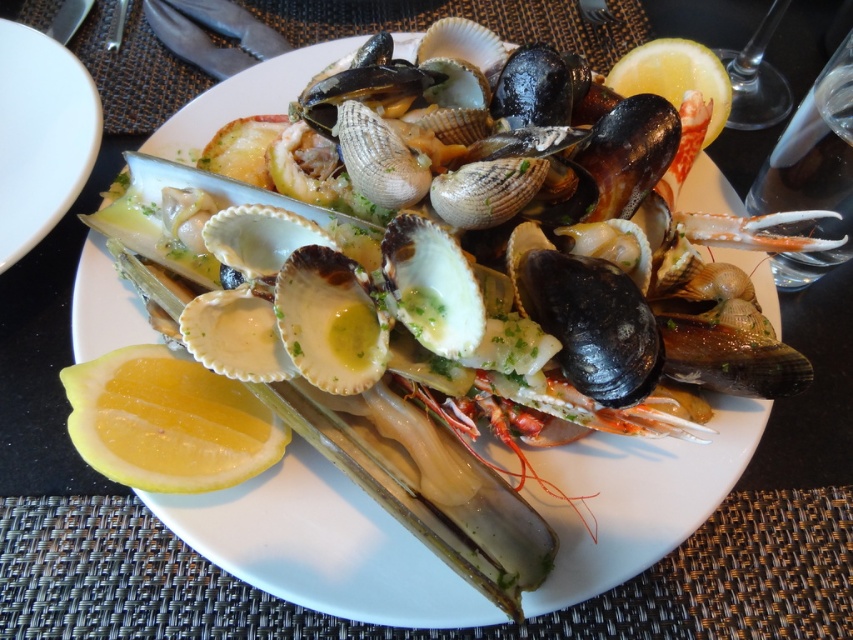
Which of these two, white glossy plate at upper left or yellow matte lemon at upper right, stands taller?

Standing taller between the two is white glossy plate at upper left.

Consider the image. Does white glossy plate at upper left appear over yellow matte lemon at upper right?

No.

This screenshot has width=853, height=640. Describe the element at coordinates (39, 134) in the screenshot. I see `white glossy plate at upper left` at that location.

The image size is (853, 640). In order to click on white glossy plate at upper left in this screenshot , I will do `click(39, 134)`.

Can you confirm if yellow juicy lemon at lower left is positioned to the left of yellow matte lemon at upper right?

Indeed, yellow juicy lemon at lower left is positioned on the left side of yellow matte lemon at upper right.

Is yellow juicy lemon at lower left above yellow matte lemon at upper right?

No, yellow juicy lemon at lower left is not above yellow matte lemon at upper right.

Describe the element at coordinates (167, 422) in the screenshot. I see `yellow juicy lemon at lower left` at that location.

Locate an element on the screen. yellow juicy lemon at lower left is located at coordinates (167, 422).

Does yellow juicy lemon at lower left have a lesser width compared to white glossy plate at upper left?

Correct, yellow juicy lemon at lower left's width is less than white glossy plate at upper left's.

Based on the photo, is yellow juicy lemon at lower left smaller than white glossy plate at upper left?

Indeed, yellow juicy lemon at lower left has a smaller size compared to white glossy plate at upper left.

Is point (186, 444) closer to camera compared to point (36, 77)?

Yes.

The image size is (853, 640). Identify the location of yellow juicy lemon at lower left. (167, 422).